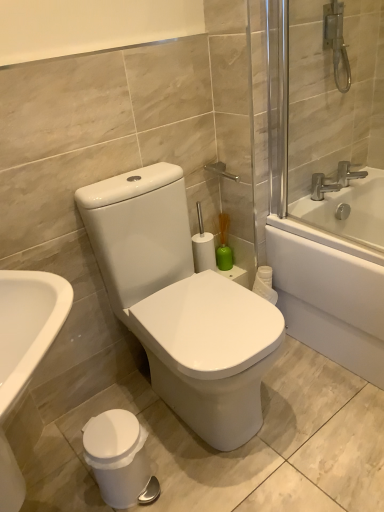
You are a GUI agent. You are given a task and a screenshot of the screen. Output one action in this format:
    pyautogui.click(x=<x>, y=<y>)
    Task: Click on the vacant space in front of white glossy toilet at center
    
    Given the screenshot: What is the action you would take?
    pyautogui.click(x=237, y=475)